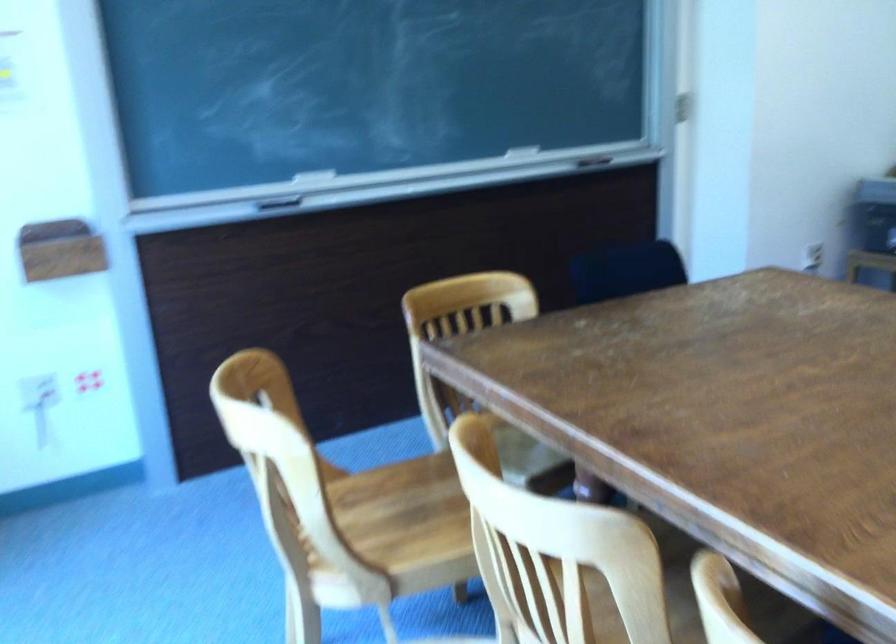
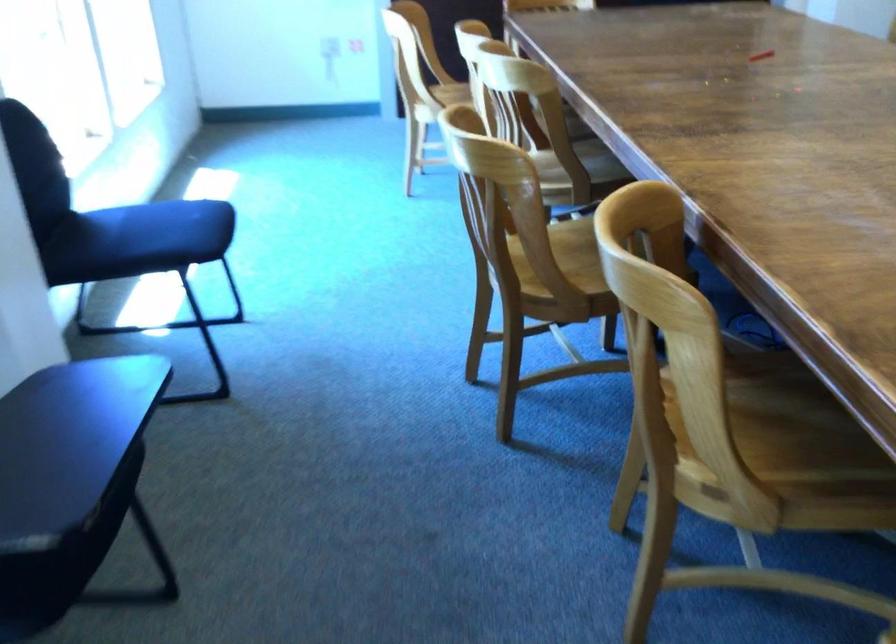
Which direction would the cameraman need to move to produce the second image?

The cameraman moved toward right, backward.